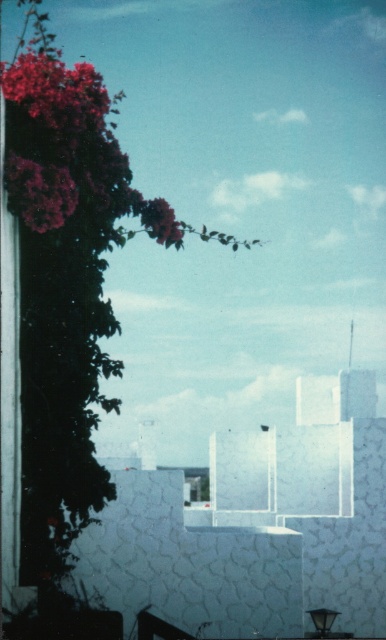
Question: Does matte purple flower at upper left appear over purple matte flower at upper left?

Choices:
 (A) no
 (B) yes

Answer: (A)

Question: Among these points, which one is nearest to the camera?

Choices:
 (A) (32, 104)
 (B) (72, 177)
 (C) (150, 236)

Answer: (A)

Question: Which point is closer to the camera taking this photo?

Choices:
 (A) (30, 97)
 (B) (150, 204)

Answer: (A)

Question: Based on their relative distances, which object is farther from the vivid purple petals at upper left?

Choices:
 (A) matte purple flower at upper left
 (B) purple matte flower at upper left

Answer: (B)

Question: Can you confirm if vivid purple petals at upper left is positioned above purple matte flower at upper left?

Choices:
 (A) yes
 (B) no

Answer: (A)

Question: Does vivid purple petals at upper left have a lesser width compared to purple matte flower at upper left?

Choices:
 (A) no
 (B) yes

Answer: (A)